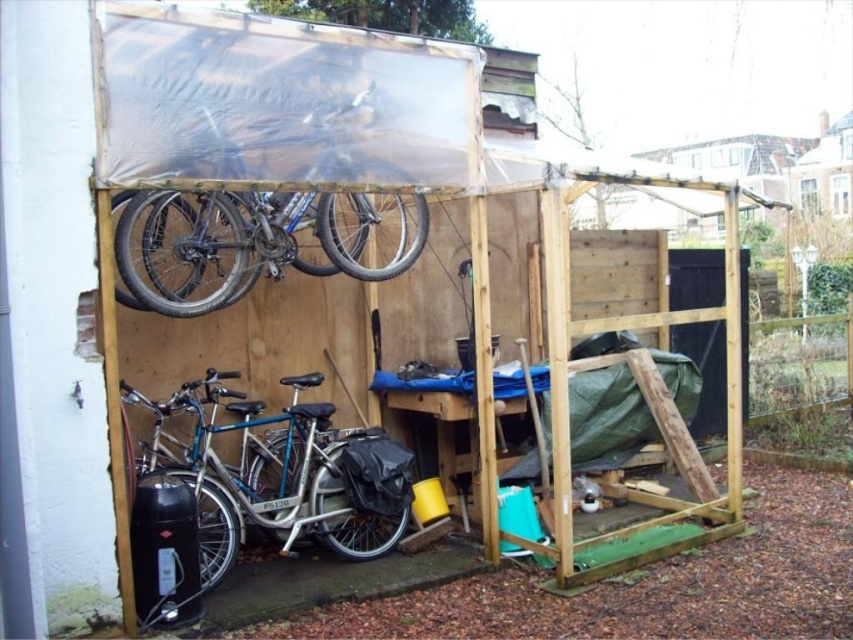
Question: Which point is closer to the camera?

Choices:
 (A) silver metallic bicycle at lower left
 (B) shiny metallic bicycle at upper center

Answer: (B)

Question: Does silver metallic bicycle at lower left have a larger size compared to shiny metallic bicycle at upper center?

Choices:
 (A) no
 (B) yes

Answer: (A)

Question: Is silver metallic bicycle at lower left bigger than shiny metallic bicycle at upper center?

Choices:
 (A) no
 (B) yes

Answer: (A)

Question: Which point is farther to the camera?

Choices:
 (A) silver metallic bicycle at lower left
 (B) shiny metallic bicycle at upper center

Answer: (A)

Question: Which of the following is the farthest from the observer?

Choices:
 (A) silver metallic bicycle at lower left
 (B) shiny metallic bicycle at upper center

Answer: (A)

Question: Is silver metallic bicycle at lower left smaller than shiny metallic bicycle at upper center?

Choices:
 (A) yes
 (B) no

Answer: (A)